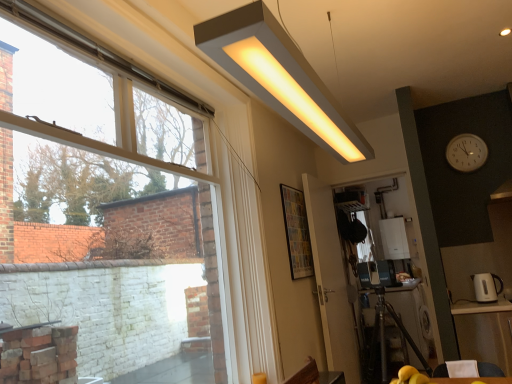
Question: Looking at the image, does white glossy boiler at center, the 1th appliance positioned from the back, seem bigger or smaller compared to white glossy electric kettle at right, which is the second appliance from back to front?

Choices:
 (A) big
 (B) small

Answer: (A)

Question: Is white glossy boiler at center, the 1th appliance positioned from the back, inside the boundaries of white glossy electric kettle at right, placed as the second appliance when sorted from right to left, or outside?

Choices:
 (A) outside
 (B) inside

Answer: (A)

Question: Which of these objects is positioned closest to the white plastic clock at upper right?

Choices:
 (A) wooden table at lower right, which is the second table in back-to-front order
 (B) matte white rectangular light fixture at upper center
 (C) white glossy screen door at lower right, positioned as the first screen door in right-to-left order
 (D) transparent plastic screen door at center, the second screen door from the right
 (E) wooden table at lower right, acting as the 2th table starting from the front

Answer: (A)

Question: Based on their relative distances, which object is farther from the transparent glass window at upper left?

Choices:
 (A) transparent plastic screen door at center, the second screen door from the right
 (B) white glossy electric kettle at right, which is the second appliance from back to front
 (C) wooden table at lower right, acting as the first table starting from the front
 (D) white plastic clock at upper right
 (E) white glossy screen door at lower right, positioned as the first screen door in right-to-left order

Answer: (D)